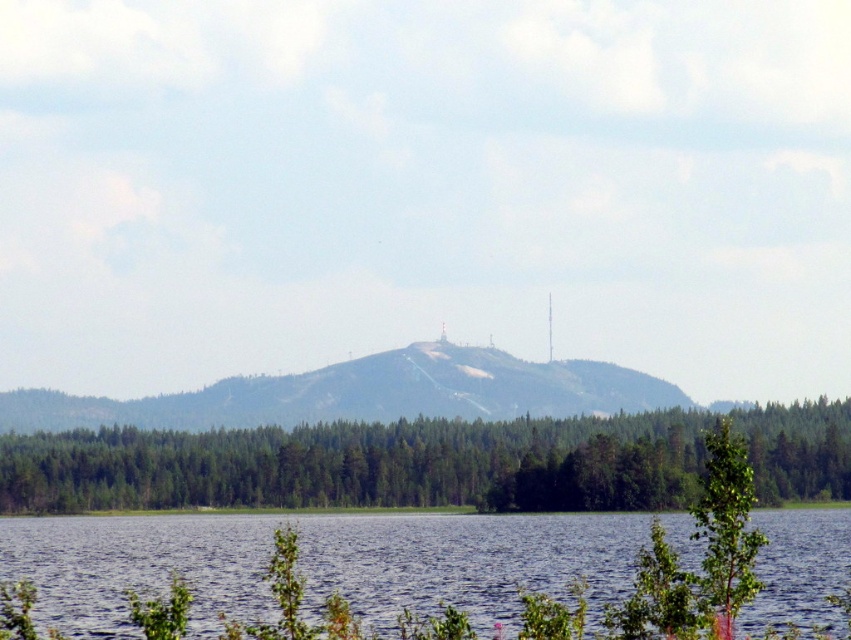
This screenshot has height=640, width=851. What do you see at coordinates (317, 564) in the screenshot?
I see `blue water at lower center` at bounding box center [317, 564].

Does blue water at lower center have a lesser width compared to green forested mountain at center?

Yes, blue water at lower center is thinner than green forested mountain at center.

Locate an element on the screen. blue water at lower center is located at coordinates (317, 564).

Can you confirm if green matte tree at lower center is thinner than green forested mountain at center?

Yes.

Between green matte tree at lower center and green forested mountain at center, which one has less height?

green matte tree at lower center

The width and height of the screenshot is (851, 640). What do you see at coordinates (364, 465) in the screenshot?
I see `green matte tree at lower center` at bounding box center [364, 465].

Locate an element on the screen. green matte tree at lower center is located at coordinates (364, 465).

Which is in front, point (381, 538) or point (703, 422)?

Point (381, 538)

Is blue water at lower center bigger than green matte tree at lower center?

Indeed, blue water at lower center has a larger size compared to green matte tree at lower center.

You are a GUI agent. You are given a task and a screenshot of the screen. Output one action in this format:
    pyautogui.click(x=<x>, y=<y>)
    Task: Click on the blue water at lower center
    
    Given the screenshot: What is the action you would take?
    pyautogui.click(x=317, y=564)

Where is `blue water at lower center`? This screenshot has width=851, height=640. blue water at lower center is located at coordinates (317, 564).